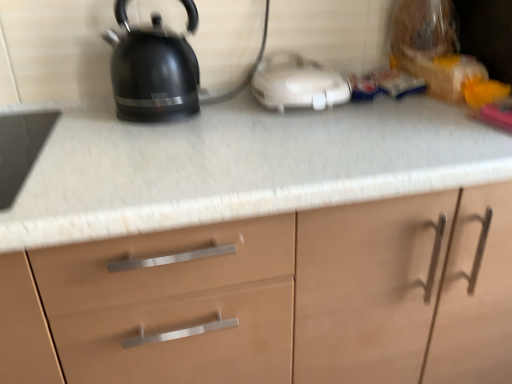
This screenshot has height=384, width=512. Find the location of `free location to the left of black glossy kettle at upper left`. free location to the left of black glossy kettle at upper left is located at coordinates (79, 119).